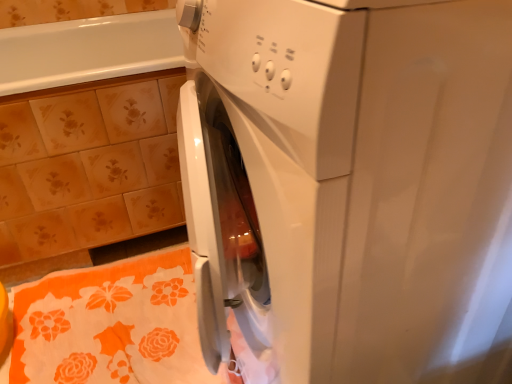
The image size is (512, 384). I want to click on floral ceramic tile at upper left, so click(x=88, y=167).

Describe the element at coordinates (111, 325) in the screenshot. This screenshot has width=512, height=384. I see `orange floral bath towel at lower left` at that location.

This screenshot has width=512, height=384. Find the location of `floral ceramic tile at upper left`. floral ceramic tile at upper left is located at coordinates (88, 167).

Locate an element on the screen. The height and width of the screenshot is (384, 512). washing machine in front of the floral ceramic tile at upper left is located at coordinates (351, 185).

Is white glossy washing machine at center not within floral ceramic tile at upper left?

Yes, white glossy washing machine at center is outside of floral ceramic tile at upper left.

How much distance is there between white glossy washing machine at center and floral ceramic tile at upper left?

white glossy washing machine at center and floral ceramic tile at upper left are 24.07 inches apart.

Does white glossy washing machine at center have a lesser height compared to floral ceramic tile at upper left?

No.

Is orange floral bath towel at lower left positioned behind floral ceramic tile at upper left?

That is False.

Based on their sizes in the image, would you say orange floral bath towel at lower left is bigger or smaller than floral ceramic tile at upper left?

Clearly, orange floral bath towel at lower left is smaller in size than floral ceramic tile at upper left.

Is orange floral bath towel at lower left with floral ceramic tile at upper left?

No, orange floral bath towel at lower left is not touching floral ceramic tile at upper left.

Which is correct: orange floral bath towel at lower left is inside white glossy washing machine at center, or outside of it?

orange floral bath towel at lower left is outside white glossy washing machine at center.

Visually, is orange floral bath towel at lower left positioned to the left or to the right of white glossy washing machine at center?

Based on their positions, orange floral bath towel at lower left is located to the left of white glossy washing machine at center.

From a real-world perspective, is orange floral bath towel at lower left physically below white glossy washing machine at center?

Yes.

Could you tell me if orange floral bath towel at lower left is turned towards white glossy washing machine at center?

No, orange floral bath towel at lower left does not turn towards white glossy washing machine at center.

Looking at this image, is there a large distance between floral ceramic tile at upper left and white glossy washing machine at center?

No, floral ceramic tile at upper left is not far away from white glossy washing machine at center.

From a real-world perspective, which object stands above the other?

white glossy washing machine at center, from a real-world perspective.

Does point (21, 122) lie behind point (368, 71)?

Yes, it is.

In terms of size, does floral ceramic tile at upper left appear bigger or smaller than orange floral bath towel at lower left?

floral ceramic tile at upper left is bigger than orange floral bath towel at lower left.

Which is correct: floral ceramic tile at upper left is inside orange floral bath towel at lower left, or outside of it?

floral ceramic tile at upper left is not inside orange floral bath towel at lower left, it's outside.

Can you confirm if floral ceramic tile at upper left is wider than orange floral bath towel at lower left?

Indeed, floral ceramic tile at upper left has a greater width compared to orange floral bath towel at lower left.

Identify the location of bath towel below the floral ceramic tile at upper left (from a real-world perspective). The width and height of the screenshot is (512, 384). (111, 325).

Who is taller, white glossy washing machine at center or orange floral bath towel at lower left?

With more height is white glossy washing machine at center.

Which is correct: white glossy washing machine at center is inside orange floral bath towel at lower left, or outside of it?

white glossy washing machine at center exists outside the volume of orange floral bath towel at lower left.

Would you say white glossy washing machine at center is to the left or to the right of orange floral bath towel at lower left in the picture?

Based on their positions, white glossy washing machine at center is located to the right of orange floral bath towel at lower left.

What's the angular difference between white glossy washing machine at center and orange floral bath towel at lower left's facing directions?

The angular difference between white glossy washing machine at center and orange floral bath towel at lower left is 88.6 degrees.

Identify the location of washing machine lying in front of the floral ceramic tile at upper left. This screenshot has width=512, height=384. [x=351, y=185].

Locate an element on the screen. The height and width of the screenshot is (384, 512). ceramic tile behind the orange floral bath towel at lower left is located at coordinates coord(88,167).

Estimate the real-world distances between objects in this image. Which object is further from orange floral bath towel at lower left, white glossy washing machine at center or floral ceramic tile at upper left?

Based on the image, white glossy washing machine at center appears to be further to orange floral bath towel at lower left.

Based on their spatial positions, is white glossy washing machine at center or orange floral bath towel at lower left further from floral ceramic tile at upper left?

Among the two, white glossy washing machine at center is located further to floral ceramic tile at upper left.

Looking at the image, which one is located further to orange floral bath towel at lower left, floral ceramic tile at upper left or white glossy washing machine at center?

white glossy washing machine at center is positioned further to the anchor orange floral bath towel at lower left.

When comparing their distances from white glossy washing machine at center, does orange floral bath towel at lower left or floral ceramic tile at upper left seem closer?

orange floral bath towel at lower left.

Consider the image. Considering their positions, is floral ceramic tile at upper left positioned further to white glossy washing machine at center than orange floral bath towel at lower left?

floral ceramic tile at upper left.

Which object lies further to the anchor point floral ceramic tile at upper left, orange floral bath towel at lower left or white glossy washing machine at center?

The object further to floral ceramic tile at upper left is white glossy washing machine at center.

Image resolution: width=512 pixels, height=384 pixels. In order to click on bath towel between white glossy washing machine at center and floral ceramic tile at upper left from front to back in this screenshot , I will do (111, 325).